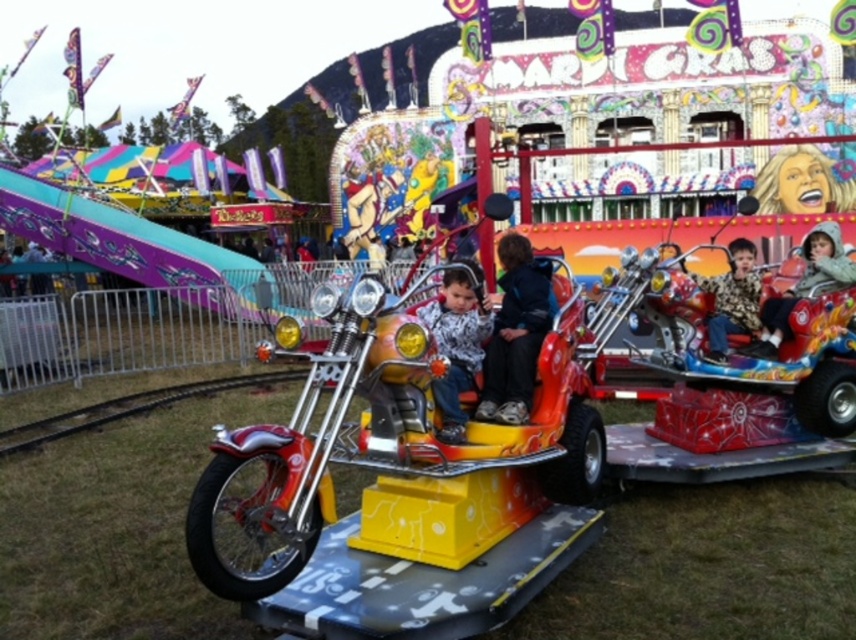
Question: Which is farther from the floral-patterned shirt at center?

Choices:
 (A) matte black jacket at upper right
 (B) shiny chrome motorcycle at center

Answer: (B)

Question: Is printed fabric shirt at center bigger than matte black jacket at upper right?

Choices:
 (A) yes
 (B) no

Answer: (B)

Question: Can you confirm if shiny chrome motorcycle at center is thinner than matte black jacket at upper right?

Choices:
 (A) no
 (B) yes

Answer: (A)

Question: Among these objects, which one is nearest to the camera?

Choices:
 (A) floral-patterned shirt at center
 (B) matte black jacket at upper right
 (C) dark blue jacket at center

Answer: (C)

Question: Which object is closer to the camera taking this photo?

Choices:
 (A) floral-patterned shirt at center
 (B) printed fabric shirt at center
 (C) matte black jacket at upper right

Answer: (B)

Question: Does dark blue jacket at center have a larger size compared to matte black jacket at upper right?

Choices:
 (A) yes
 (B) no

Answer: (A)